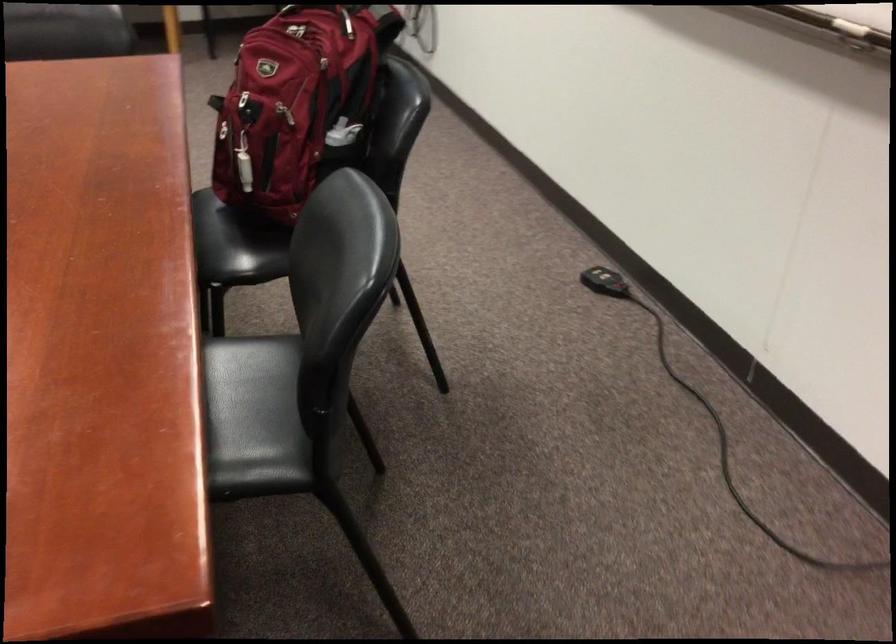
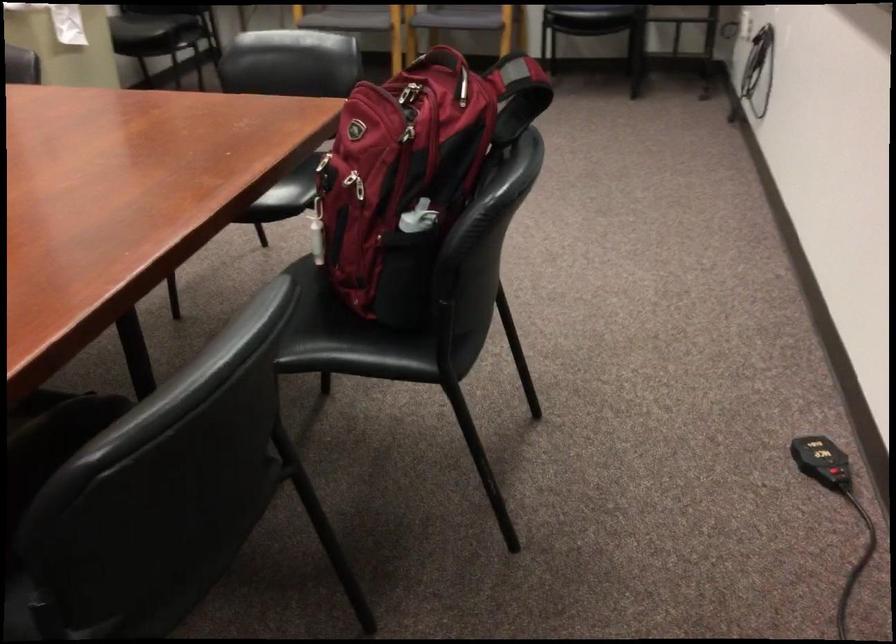
Question: The first image is from the beginning of the video and the second image is from the end. How did the camera likely rotate when shooting the video?

Choices:
 (A) Left
 (B) Right
 (C) Up
 (D) Down

Answer: (A)